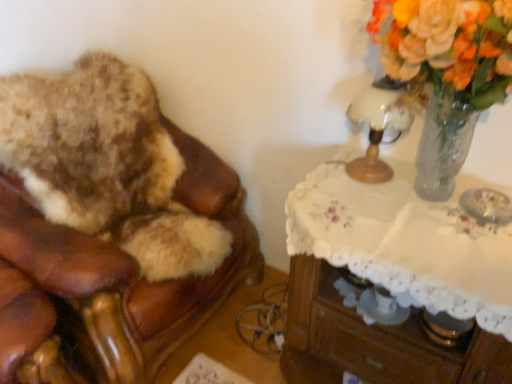
Image resolution: width=512 pixels, height=384 pixels. Identify the location of free location to the right of white glass table lamp at upper right. (414, 188).